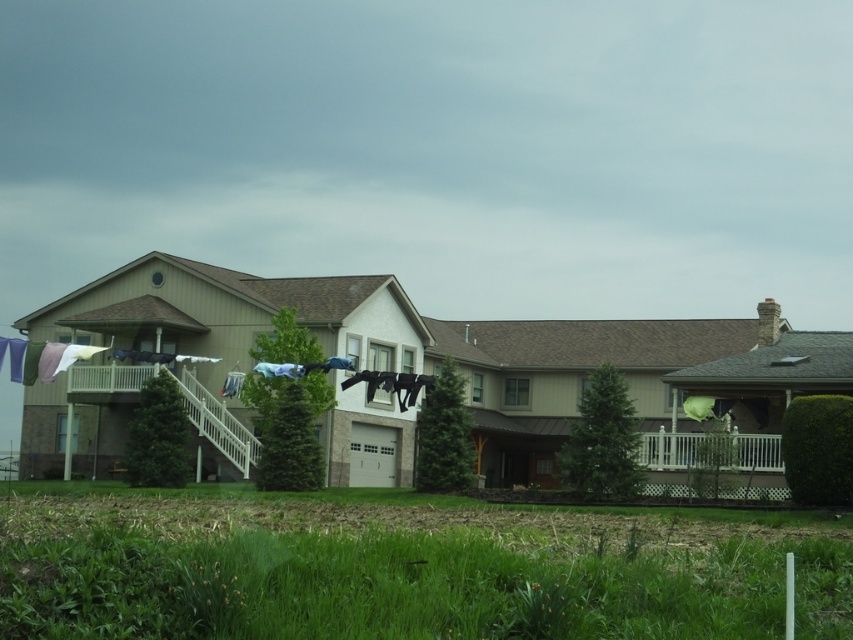
You are standing at the base of the house looking towards the garage door. There are two points marked in the image, one at coordinates point (749, 627) and another at point (755, 458). Which point is closer to you?

Point (749, 627) is in front of point (755, 458), so it is closer to you.

You are standing in the suburban residential setting described. You need to walk from the green grass at lower center to the white wooden porch at right. Which direction should you head?

You should head to the right since the green grass at lower center is to the left of the white wooden porch at right.

You are a gardener who needs to mow the lawn. You see the green grass at lower center and the white wooden porch at right. Which area should you prioritize mowing first based on their height?

The green grass at lower center should be prioritized for mowing first since it is taller than the white wooden porch at right, indicating it requires attention.